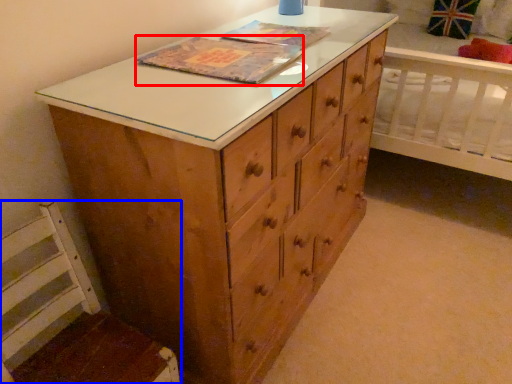
Question: Which of the following is the closest to the observer, book cover (highlighted by a red box) or swivel chair (highlighted by a blue box)?

Choices:
 (A) book cover
 (B) swivel chair

Answer: (B)